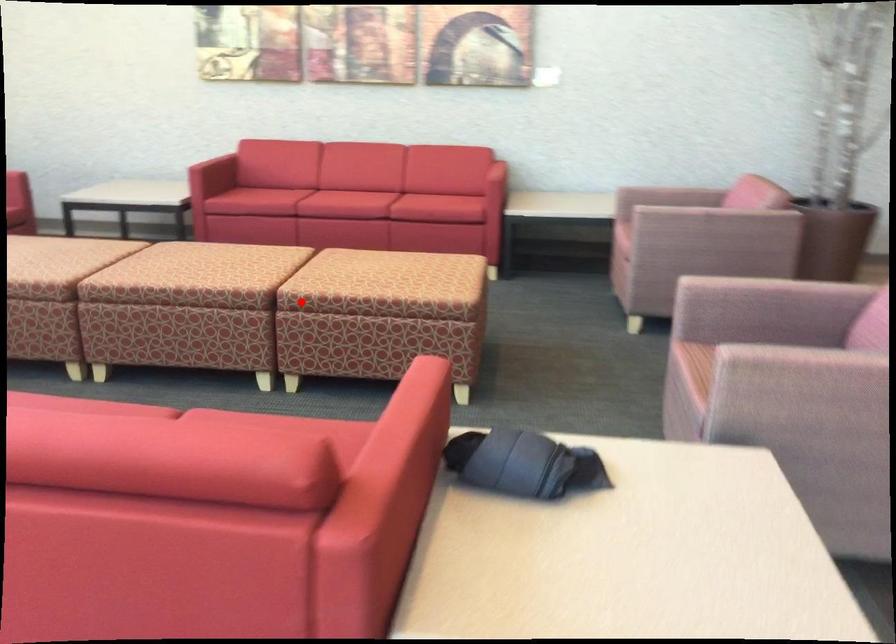
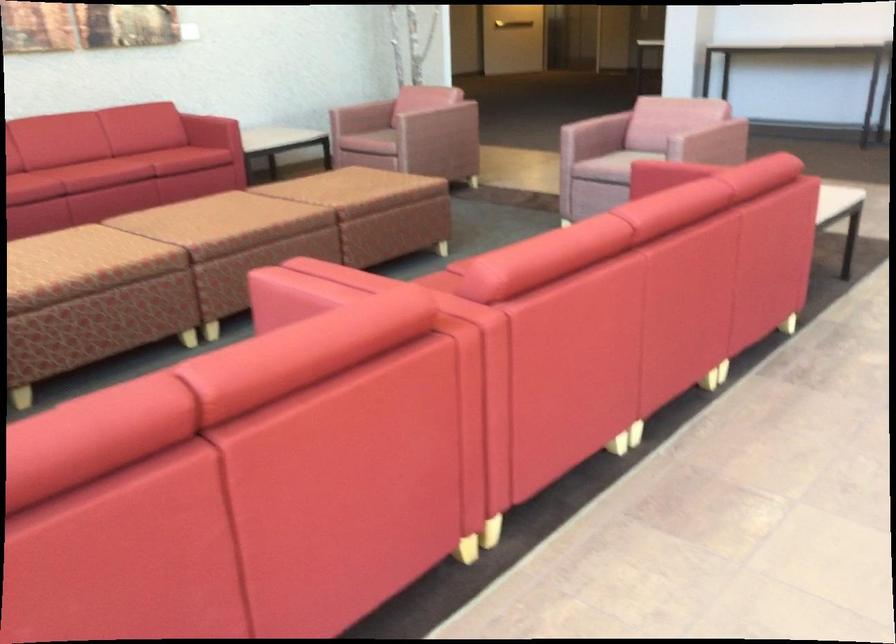
Question: I am providing you with two images of the same scene from different viewpoints. A red point is marked on the first image. At the location where the point appears in image 1, is it still visible in image 2?

Choices:
 (A) Yes
 (B) No

Answer: (A)